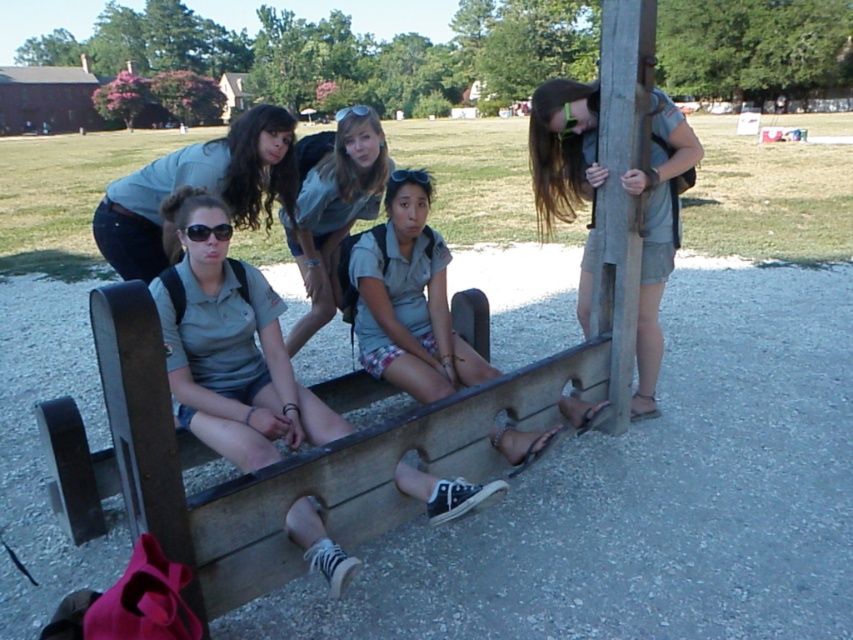
You are standing in front of the stocks and want to place a small flag at the point closer to you. Which point should you choose between point (619, 112) and point (138, 195)?

Point (619, 112) is closer to the camera than point (138, 195), so you should place the flag at point (619, 112).

You are a photographer trying to capture a group photo of the matte gray shirt at right and the black plastic sunglasses at center. If you want to ensure both are clearly visible in the frame, which object should you focus on first?

The matte gray shirt at right should be focused on first because its width is larger than the black plastic sunglasses at center, making it more prominent in the frame.

You are standing at point (x=599, y=316) and want to walk to point (x=550, y=138). Which direction should you move in relation to the stocks structure?

You should move behind the stocks structure to reach point (x=550, y=138) since it is located behind point (x=599, y=316).